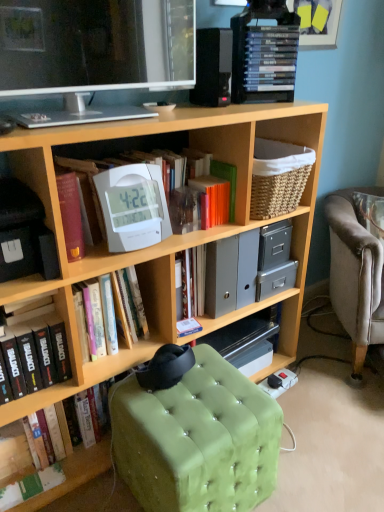
Question: Is matte white television at upper left at the left side of white plastic clock at center, the fourth book in the bottom-to-top sequence?

Choices:
 (A) yes
 (B) no

Answer: (A)

Question: Is matte white television at upper left surrounding white plastic clock at center, the fourth book in the bottom-to-top sequence?

Choices:
 (A) yes
 (B) no

Answer: (B)

Question: Considering the relative positions of matte white television at upper left and white plastic clock at center, the fourth book in the bottom-to-top sequence, in the image provided, is matte white television at upper left behind white plastic clock at center, the fourth book in the bottom-to-top sequence,?

Choices:
 (A) yes
 (B) no

Answer: (B)

Question: Is matte white television at upper left facing away from white plastic clock at center, the fourth book in the bottom-to-top sequence?

Choices:
 (A) no
 (B) yes

Answer: (A)

Question: Considering the relative sizes of matte white television at upper left and white plastic clock at center, arranged as the second book when viewed from the top, in the image provided, is matte white television at upper left taller than white plastic clock at center, arranged as the second book when viewed from the top,?

Choices:
 (A) yes
 (B) no

Answer: (A)

Question: Is matte white television at upper left closer to the viewer compared to white plastic clock at center, arranged as the second book when viewed from the top?

Choices:
 (A) yes
 (B) no

Answer: (A)

Question: Is green paper book at lower left, which appears as the 1th book when ordered from the bottom, not close to wooden bookcase at center?

Choices:
 (A) no
 (B) yes

Answer: (A)

Question: Is green paper book at lower left, acting as the 5th book starting from the top, closer to camera compared to wooden bookcase at center?

Choices:
 (A) no
 (B) yes

Answer: (A)

Question: Is green paper book at lower left, acting as the 5th book starting from the top, outside wooden bookcase at center?

Choices:
 (A) yes
 (B) no

Answer: (B)

Question: Does green paper book at lower left, acting as the 5th book starting from the top, have a lesser width compared to wooden bookcase at center?

Choices:
 (A) no
 (B) yes

Answer: (B)

Question: From a real-world perspective, does green paper book at lower left, which appears as the 1th book when ordered from the bottom, stand above wooden bookcase at center?

Choices:
 (A) no
 (B) yes

Answer: (A)

Question: Does green paper book at lower left, which appears as the 1th book when ordered from the bottom, have a lesser height compared to wooden bookcase at center?

Choices:
 (A) no
 (B) yes

Answer: (B)

Question: From a real-world perspective, is black matte book at lower left, marked as the second book in a bottom-to-top arrangement, over gray plastic file folders at center?

Choices:
 (A) no
 (B) yes

Answer: (A)